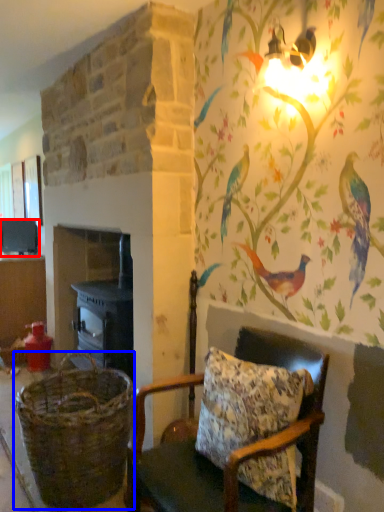
Question: Which object appears farthest to the camera in this image, appliance (highlighted by a red box) or basket (highlighted by a blue box)?

Choices:
 (A) appliance
 (B) basket

Answer: (A)